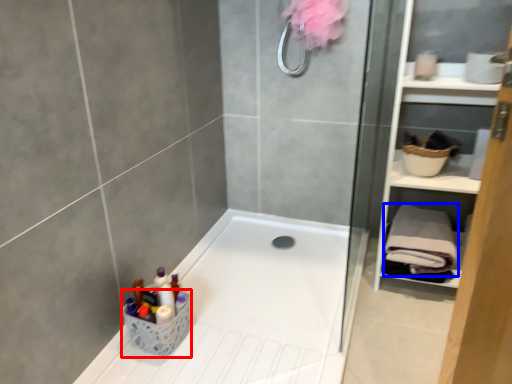
Question: Among these objects, which one is farthest to the camera, basket (highlighted by a red box) or bath towel (highlighted by a blue box)?

Choices:
 (A) basket
 (B) bath towel

Answer: (B)